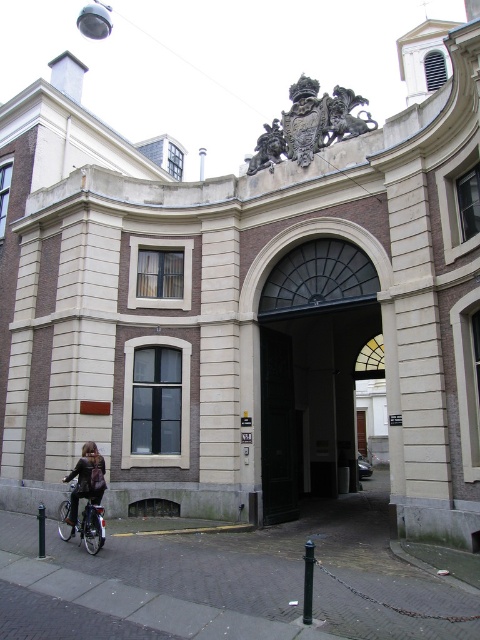
You are an architect analyzing the symmetry of the building. You notice a point at coordinates (x=310, y=124). Based on the scene description, where is this point located?

The point at coordinates (x=310, y=124) is on the gold metallic coat of arms at center top.

You are an architect visiting this historic building and want to compare the sizes of the gold metallic coat of arms at center top and the bronze statue at center. Which one is taller?

The gold metallic coat of arms at center top is taller than the bronze statue at center.

You are a tour guide describing the historic building to visitors. You point out the gold metallic coat of arms at center top and the silver metallic bicycle at lower left. Which of the two objects is positioned to the right side of the other?

The gold metallic coat of arms at center top is positioned to the right of the silver metallic bicycle at lower left.